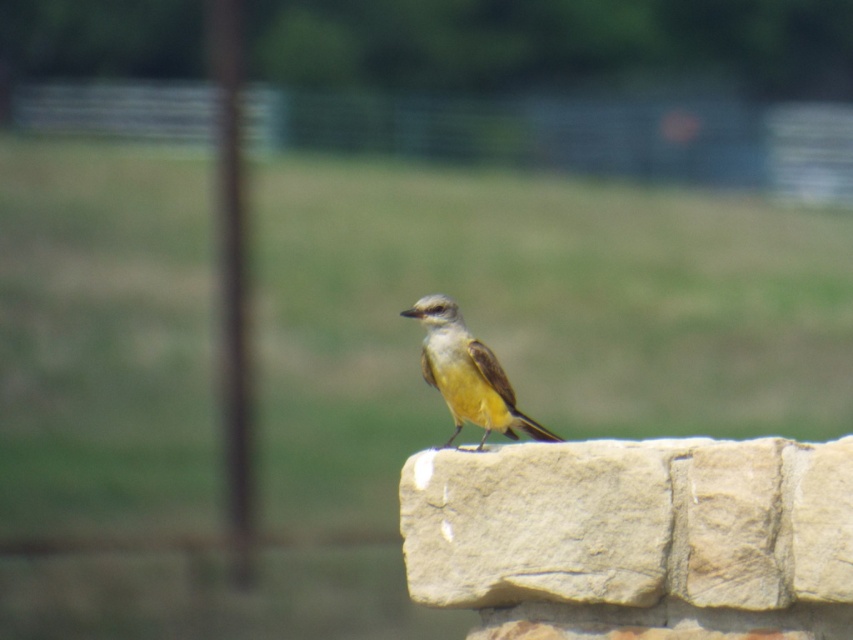
You are a photographer trying to capture the yellow matte bird at center. You notice the beige rough stone at center in the foreground. Will the bird be visible behind the stone?

The beige rough stone at center is in front of the yellow matte bird at center, so the bird may be partially or fully obscured by the stone depending on their positions and the camera angle.

You are a small toy that is 3 inches in height. You want to place yourself on the beige rough stone at center so that you can be seen by someone standing near the yellow matte bird at center. Will your placement be visible to them?

The beige rough stone at center is 13.70 inches from the yellow matte bird at center. Since the toy is only 3 inches tall, it may not be tall enough to be seen over the distance unless positioned strategically on the stone.